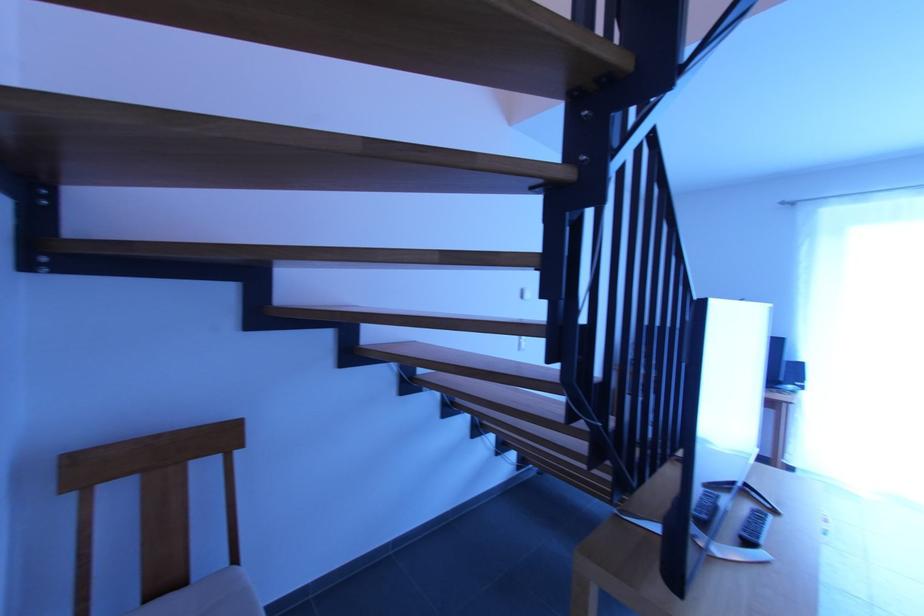
The location [754,528] corresponds to which object?

This point indicates the black remote control.